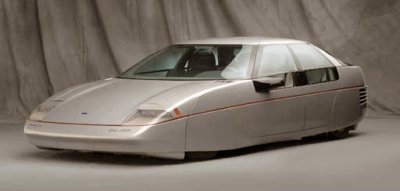
At what (x,y) coordinates should I click in order to perform the action: click on headrest. Please return your answer as a coordinate pair (x, y). Looking at the image, I should click on (195, 53), (245, 60), (306, 58).